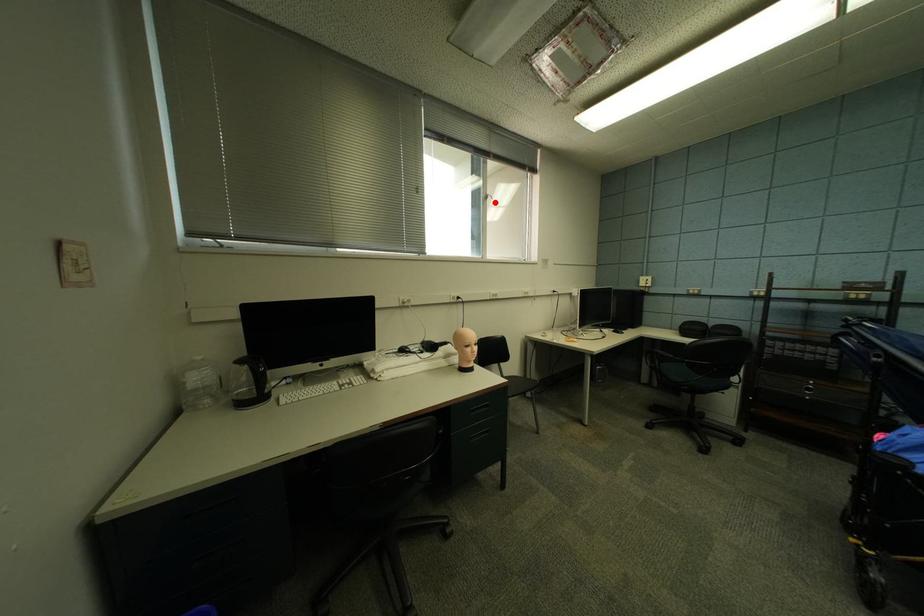
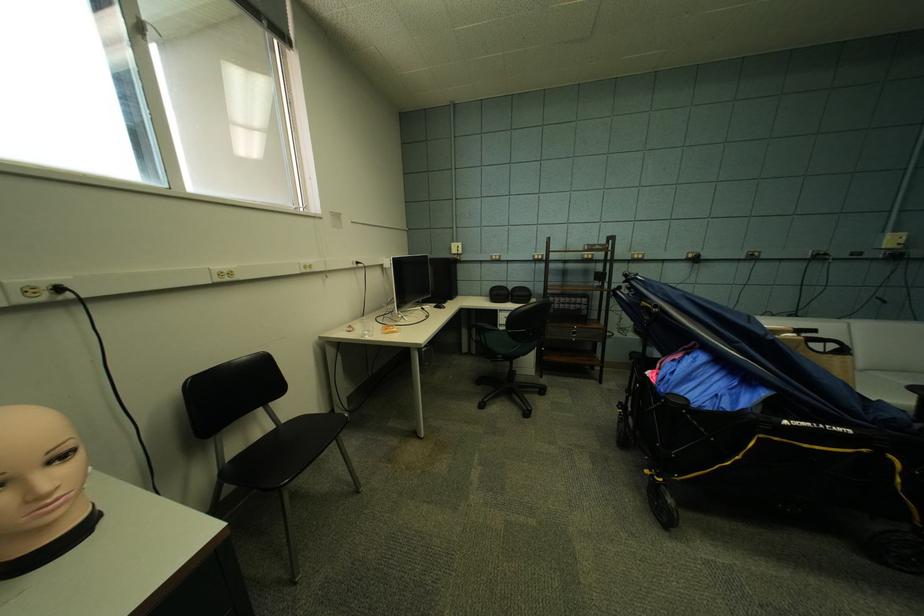
Locate, in the second image, the point that corresponds to the highlighted location in the first image.

(154, 42)